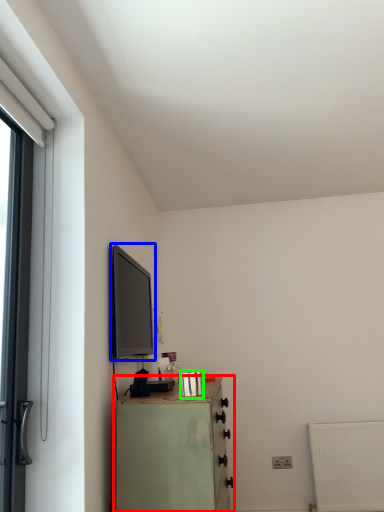
Question: Estimate the real-world distances between objects in this image. Which object is closer to chest of drawers (highlighted by a red box), window screen (highlighted by a blue box) or appliance (highlighted by a green box)?

Choices:
 (A) window screen
 (B) appliance

Answer: (B)